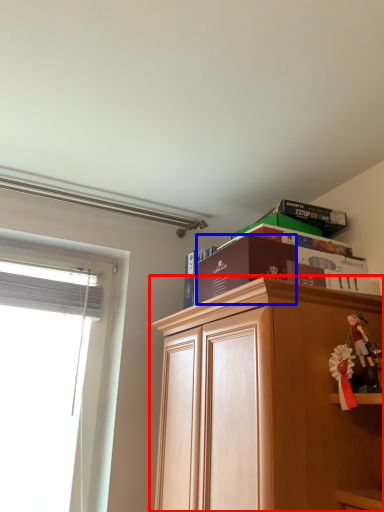
Question: Among these objects, which one is nearest to the camera, cabinetry (highlighted by a red box) or paperback book (highlighted by a blue box)?

Choices:
 (A) cabinetry
 (B) paperback book

Answer: (A)